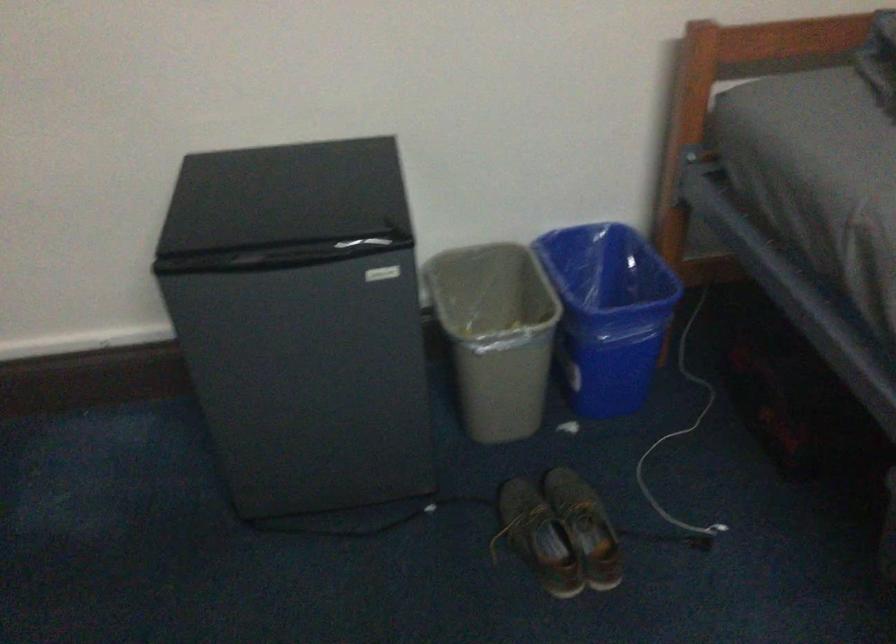
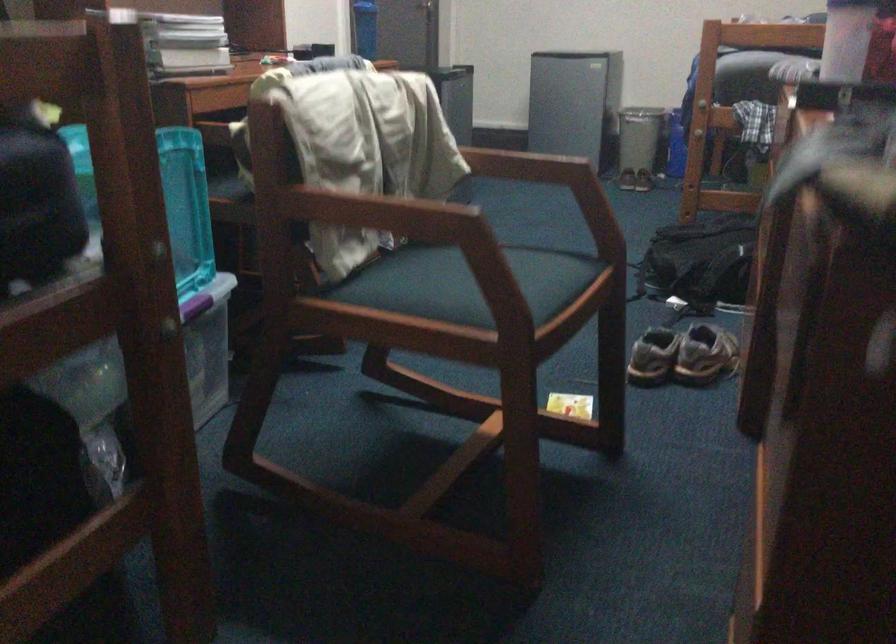
In the second image, find the point that corresponds to the point at 606,533 in the first image.

(638, 146)